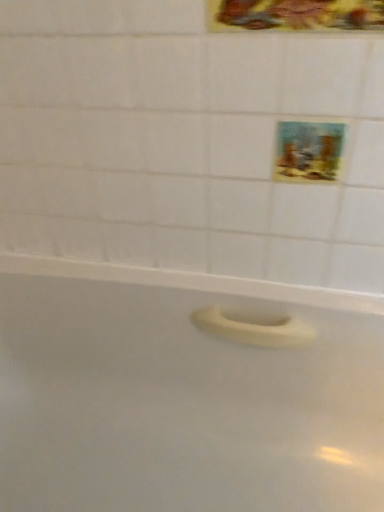
Question: Would you say white matte bathtub at center is outside pastel painted picture at upper right, positioned as the second decorative picture in front-to-back order?

Choices:
 (A) yes
 (B) no

Answer: (A)

Question: Does white matte bathtub at center turn towards pastel painted picture at upper right, positioned as the second decorative picture in front-to-back order?

Choices:
 (A) yes
 (B) no

Answer: (B)

Question: Considering the relative sizes of white matte bathtub at center and pastel painted picture at upper right, placed as the second decorative picture when sorted from top to bottom, in the image provided, is white matte bathtub at center shorter than pastel painted picture at upper right, placed as the second decorative picture when sorted from top to bottom,?

Choices:
 (A) yes
 (B) no

Answer: (B)

Question: Can you confirm if white matte bathtub at center is bigger than pastel painted picture at upper right, placed as the first decorative picture when sorted from back to front?

Choices:
 (A) no
 (B) yes

Answer: (B)

Question: From the image's perspective, would you say white matte bathtub at center is shown under pastel painted picture at upper right, placed as the first decorative picture when sorted from back to front?

Choices:
 (A) no
 (B) yes

Answer: (B)

Question: Looking at the image, does white matte bathtub at center seem bigger or smaller compared to pastel painted picture at upper right, placed as the first decorative picture when sorted from back to front?

Choices:
 (A) small
 (B) big

Answer: (B)

Question: Is white matte bathtub at center wider or thinner than pastel painted picture at upper right, the 1th decorative picture positioned from the bottom?

Choices:
 (A) thin
 (B) wide

Answer: (B)

Question: In the image, is white matte bathtub at center on the left side or the right side of pastel painted picture at upper right, the 1th decorative picture positioned from the bottom?

Choices:
 (A) right
 (B) left

Answer: (B)

Question: Considering their positions, is white matte bathtub at center located in front of or behind pastel painted picture at upper right, placed as the second decorative picture when sorted from top to bottom?

Choices:
 (A) front
 (B) behind

Answer: (A)

Question: From the image's perspective, is metallic gold frame at upper center, the 2th decorative picture ordered from the bottom, above or below white matte bathtub at center?

Choices:
 (A) above
 (B) below

Answer: (A)

Question: Is metallic gold frame at upper center, arranged as the first decorative picture when viewed from the top, spatially inside white matte bathtub at center, or outside of it?

Choices:
 (A) outside
 (B) inside

Answer: (A)

Question: Considering the positions of metallic gold frame at upper center, marked as the 2th decorative picture in a back-to-front arrangement, and white matte bathtub at center in the image, is metallic gold frame at upper center, marked as the 2th decorative picture in a back-to-front arrangement, wider or thinner than white matte bathtub at center?

Choices:
 (A) wide
 (B) thin

Answer: (B)

Question: From a real-world perspective, is metallic gold frame at upper center, marked as the 2th decorative picture in a back-to-front arrangement, physically located above or below white matte bathtub at center?

Choices:
 (A) below
 (B) above

Answer: (B)

Question: Considering their positions, is metallic gold frame at upper center, arranged as the first decorative picture when viewed from the top, located in front of or behind pastel painted picture at upper right, placed as the second decorative picture when sorted from top to bottom?

Choices:
 (A) behind
 (B) front

Answer: (B)

Question: In the image, is metallic gold frame at upper center, marked as the 2th decorative picture in a back-to-front arrangement, on the left side or the right side of pastel painted picture at upper right, placed as the second decorative picture when sorted from top to bottom?

Choices:
 (A) right
 (B) left

Answer: (B)